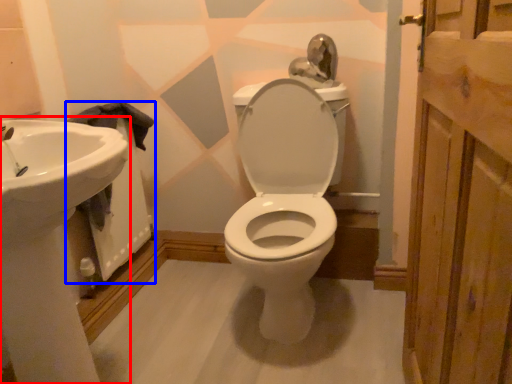
Question: Which point is closer to the camera, sink (highlighted by a red box) or bath (highlighted by a blue box)?

Choices:
 (A) sink
 (B) bath

Answer: (A)